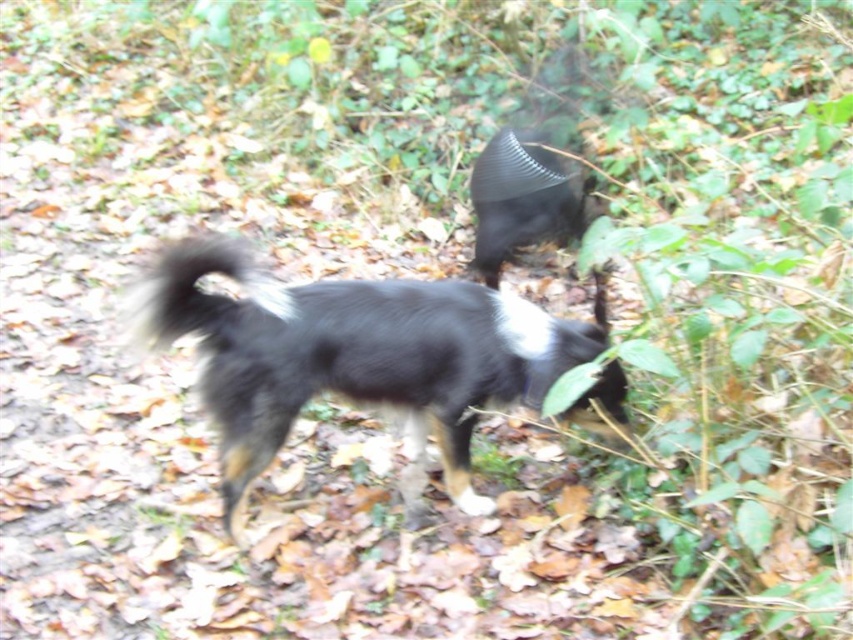
Question: Which point appears farthest from the camera in this image?

Choices:
 (A) (206, 316)
 (B) (456, 342)

Answer: (B)

Question: Can you confirm if black fuzzy dog at center is wider than fluffy black tail at center?

Choices:
 (A) yes
 (B) no

Answer: (A)

Question: Can you confirm if black fuzzy dog at center is positioned to the left of fluffy black tail at center?

Choices:
 (A) no
 (B) yes

Answer: (A)

Question: Among these points, which one is farthest from the camera?

Choices:
 (A) (228, 253)
 (B) (424, 426)

Answer: (B)

Question: Which object is farther from the camera taking this photo?

Choices:
 (A) fluffy black tail at center
 (B) black fuzzy dog at center

Answer: (A)

Question: Can you confirm if black fuzzy dog at center is smaller than fluffy black tail at center?

Choices:
 (A) no
 (B) yes

Answer: (A)